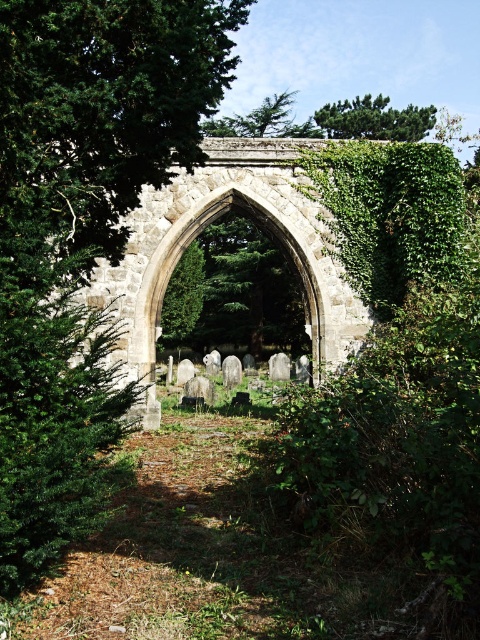
Where is `green leafy tree at center`? The image size is (480, 640). green leafy tree at center is located at coordinates (82, 230).

Does green leafy tree at center have a lesser width compared to green leafy tree at upper center?

Correct, green leafy tree at center's width is less than green leafy tree at upper center's.

In order to click on green leafy tree at center in this screenshot , I will do `click(82, 230)`.